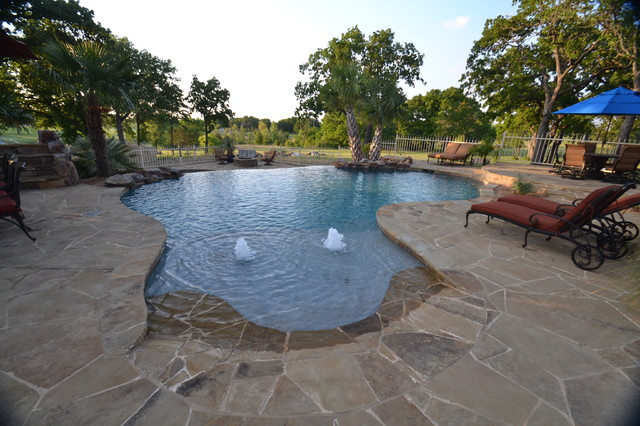
Where is `red lounge chairs`? red lounge chairs is located at coordinates (518, 209), (534, 198).